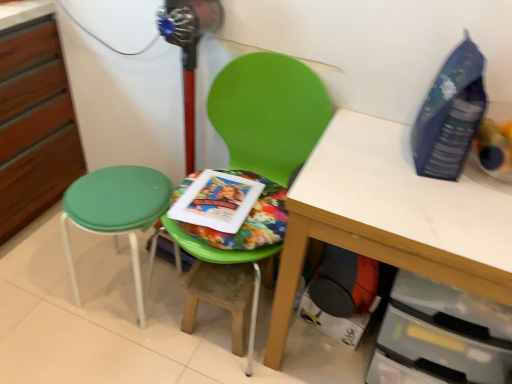
Question: Should I look upward or downward to see green plastic chair at center?

Choices:
 (A) down
 (B) up

Answer: (A)

Question: From a real-world perspective, is white matte table at center physically above green fabric stool at left?

Choices:
 (A) yes
 (B) no

Answer: (A)

Question: Are white matte table at center and green fabric stool at left located far from each other?

Choices:
 (A) no
 (B) yes

Answer: (A)

Question: Is white matte table at center shorter than green fabric stool at left?

Choices:
 (A) no
 (B) yes

Answer: (A)

Question: From the image's perspective, is white matte table at center located beneath green fabric stool at left?

Choices:
 (A) yes
 (B) no

Answer: (A)

Question: Can you confirm if white matte table at center is thinner than green fabric stool at left?

Choices:
 (A) yes
 (B) no

Answer: (B)

Question: Is green fabric stool at left a part of white matte table at center?

Choices:
 (A) yes
 (B) no

Answer: (B)

Question: Does green fabric stool at left have a larger size compared to green plastic chair at center?

Choices:
 (A) no
 (B) yes

Answer: (A)

Question: Is green fabric stool at left aimed at green plastic chair at center?

Choices:
 (A) no
 (B) yes

Answer: (A)

Question: From the image's perspective, is green fabric stool at left beneath green plastic chair at center?

Choices:
 (A) no
 (B) yes

Answer: (B)

Question: Does green fabric stool at left lie behind green plastic chair at center?

Choices:
 (A) yes
 (B) no

Answer: (A)

Question: Is green fabric stool at left far from green plastic chair at center?

Choices:
 (A) yes
 (B) no

Answer: (B)

Question: Is green fabric stool at left oriented away from green plastic chair at center?

Choices:
 (A) no
 (B) yes

Answer: (A)

Question: From the image's perspective, is white matte table at center located above blue plastic bottle at upper right?

Choices:
 (A) no
 (B) yes

Answer: (A)